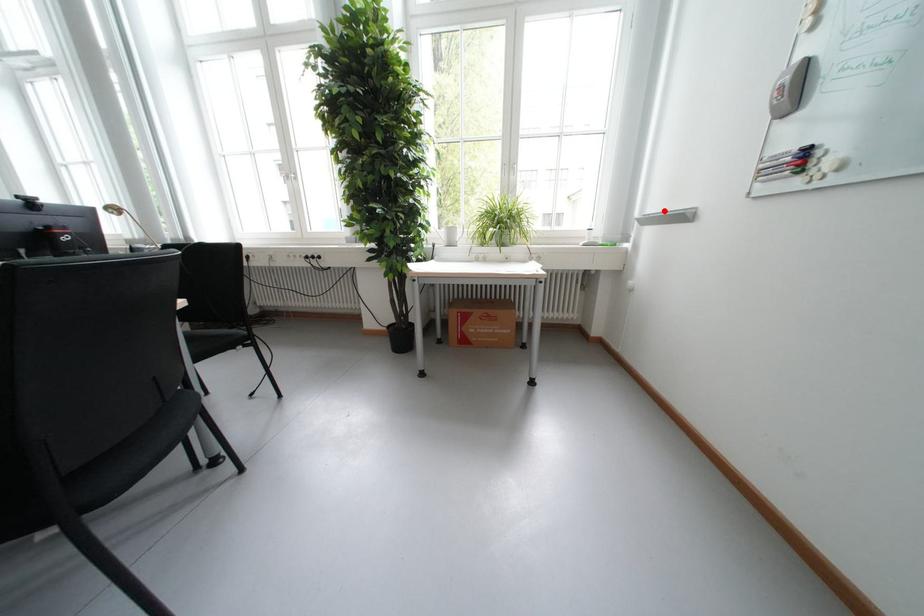
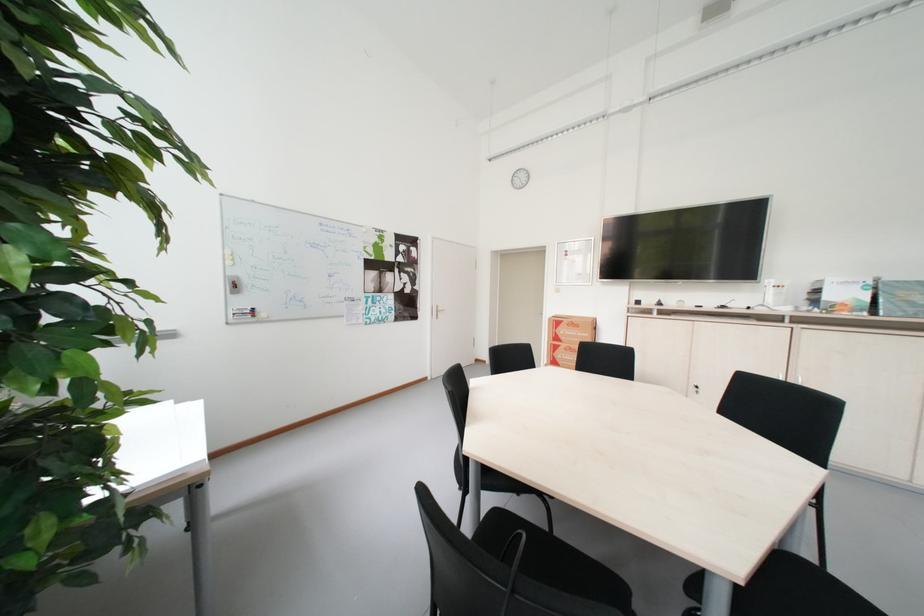
Question: I am providing you with two images of the same scene from different viewpoints. A red point is marked on the first image. At the location where the point appears in image 1, is it still visible in image 2?

Choices:
 (A) Yes
 (B) No

Answer: (B)